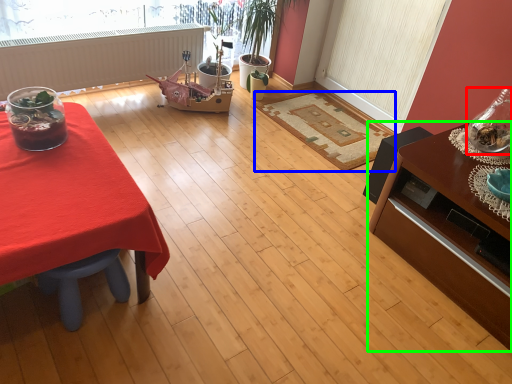
Question: Which object is the farthest from glass vase (highlighted by a red box)? Choose among these: mat (highlighted by a blue box) or table (highlighted by a green box).

Choices:
 (A) mat
 (B) table

Answer: (A)